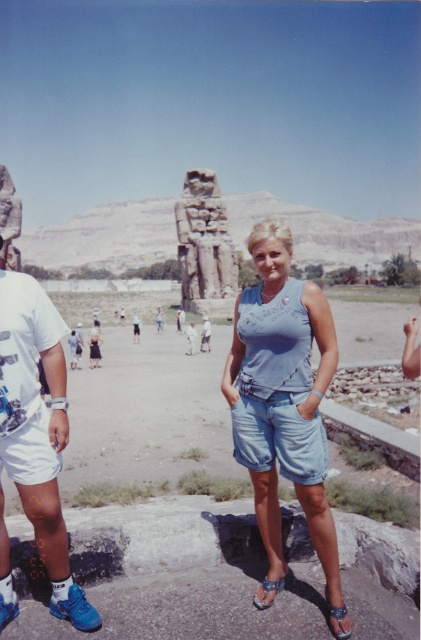
You are an archaeologist examining the scene. You need to determine which object is wider between the carved stone statue at center and the denim textured sandal at lower center. Based on the spatial details provided, which one is wider?

The carved stone statue at center is wider than the denim textured sandal at lower center according to the description.

You are a tour guide explaining the scale of the statues to visitors. You point out the blue synthetic sneakers at lower left and the carved stone statue at center. Which object is wider?

The carved stone statue at center is wider than the blue synthetic sneakers at lower left.

You are a photographer trying to capture the light blue denim shorts at center and the blue synthetic sneakers at lower left in the same frame. Which object is closer to the camera?

The light blue denim shorts at center is closer to the camera because the blue synthetic sneakers at lower left is behind it.